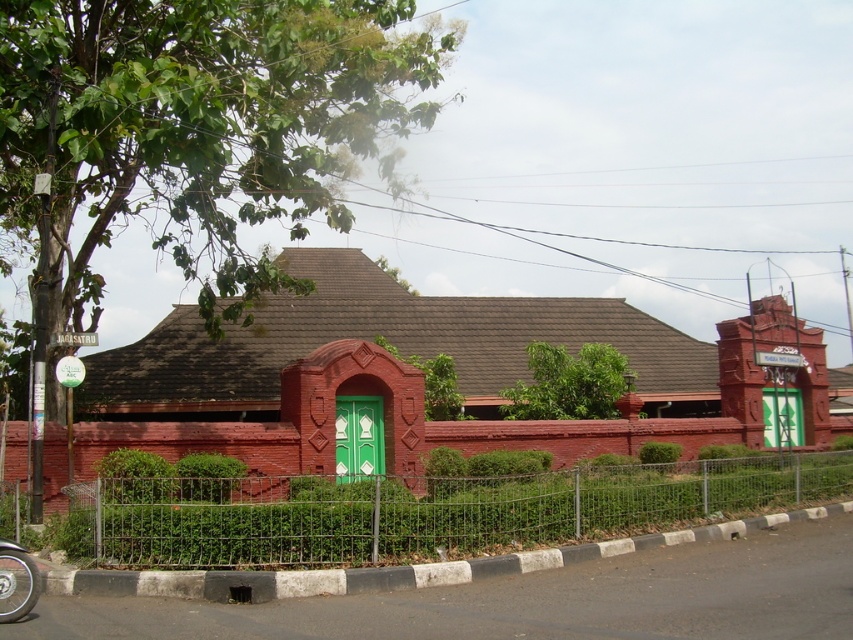
Is metal wire fence at lower center wider than shiny metallic wheel at lower left?

Indeed, metal wire fence at lower center has a greater width compared to shiny metallic wheel at lower left.

Can you confirm if metal wire fence at lower center is positioned below shiny metallic wheel at lower left?

Yes, metal wire fence at lower center is below shiny metallic wheel at lower left.

Between point (766, 502) and point (16, 602), which one is positioned behind?

Point (766, 502)

In order to click on metal wire fence at lower center in this screenshot , I will do `click(418, 512)`.